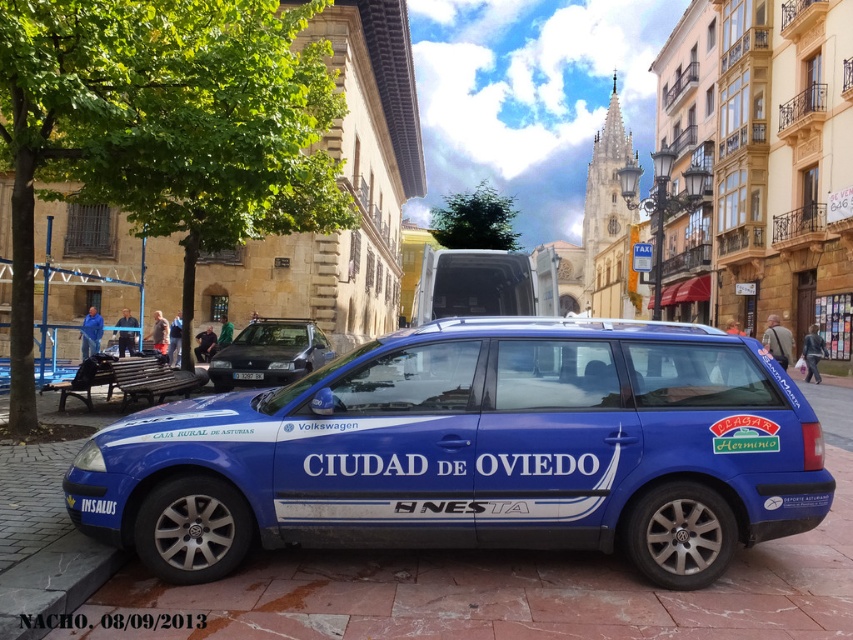
Based on the photo, who is taller, white matte van at center or shiny black sedan at center?

white matte van at center is taller.

Who is higher up, white matte van at center or shiny black sedan at center?

Result: white matte van at center is above.

Image resolution: width=853 pixels, height=640 pixels. What do you see at coordinates (473, 284) in the screenshot? I see `white matte van at center` at bounding box center [473, 284].

This screenshot has width=853, height=640. In order to click on white matte van at center in this screenshot , I will do `click(473, 284)`.

Is blue metallic car at center to the left of shiny black sedan at center from the viewer's perspective?

No, blue metallic car at center is not to the left of shiny black sedan at center.

Is blue metallic car at center wider than shiny black sedan at center?

Yes.

Who is more forward, (x=415, y=488) or (x=283, y=339)?

Point (x=415, y=488) is in front.

Locate an element on the screen. blue metallic car at center is located at coordinates pos(473,452).

Is blue metallic car at center positioned behind white matte van at center?

That is False.

Based on the photo, between blue metallic car at center and white matte van at center, which one is positioned lower?

Positioned lower is blue metallic car at center.

This screenshot has width=853, height=640. What do you see at coordinates (473, 452) in the screenshot?
I see `blue metallic car at center` at bounding box center [473, 452].

The width and height of the screenshot is (853, 640). I want to click on blue metallic car at center, so click(473, 452).